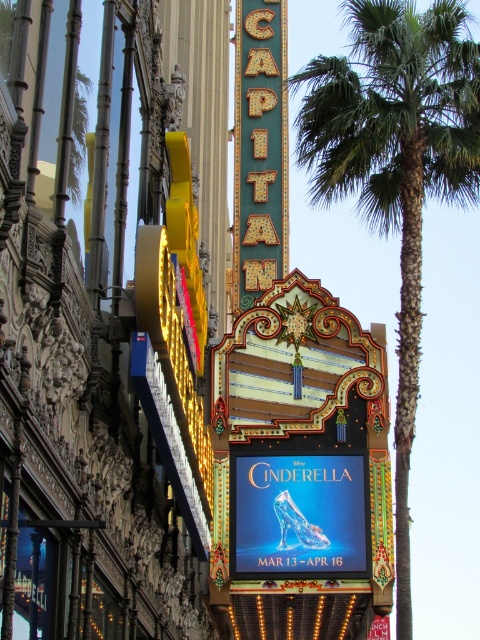
Does green leafy palm tree at center have a larger size compared to neon yellow sign at center?

Yes, green leafy palm tree at center is bigger than neon yellow sign at center.

Which is below, green leafy palm tree at center or neon yellow sign at center?

Positioned lower is neon yellow sign at center.

Who is more forward, (435, 58) or (253, 604)?

Positioned in front is point (435, 58).

What are the coordinates of `green leafy palm tree at center` in the screenshot? It's located at (396, 166).

Based on the photo, is green leafy palm tree at center behind gold metallic sign at center?

No, it is in front of gold metallic sign at center.

Locate an element on the screen. The image size is (480, 640). green leafy palm tree at center is located at coordinates (396, 166).

Between gold metallic sign at center and neon yellow sign at center, which one appears on the right side from the viewer's perspective?

Positioned to the right is neon yellow sign at center.

Can you confirm if gold metallic sign at center is positioned above neon yellow sign at center?

Yes, gold metallic sign at center is above neon yellow sign at center.

Between point (240, 35) and point (337, 604), which one is positioned behind?

Positioned behind is point (240, 35).

Where is `gold metallic sign at center`? The width and height of the screenshot is (480, 640). gold metallic sign at center is located at coordinates (260, 148).